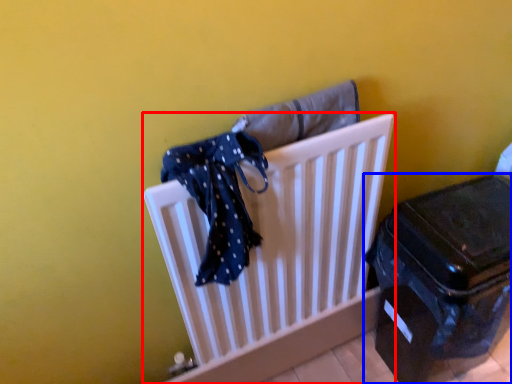
Question: Which object appears closest to the camera in this image, furniture (highlighted by a red box) or suitcase (highlighted by a blue box)?

Choices:
 (A) furniture
 (B) suitcase

Answer: (A)